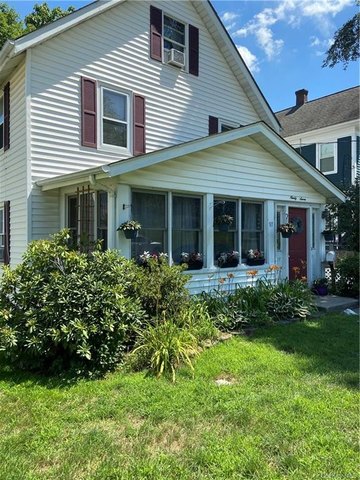
Find the location of a particular element. window is located at coordinates coord(151,216), coord(187,209), coord(226,214), coord(251,167), coord(109,115), coord(173,33).